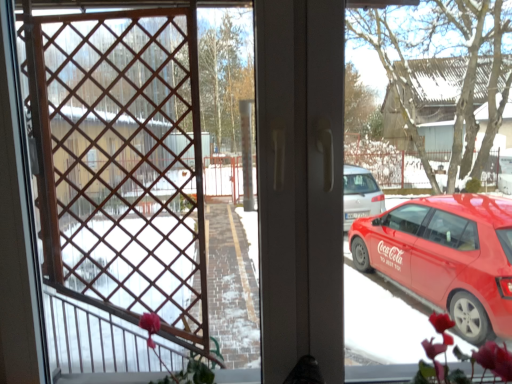
The image size is (512, 384). I want to click on matte pink roses at lower right, so click(x=460, y=358).

What is the approximate height of matte pink roses at lower right?

It is 12.79 inches.

What do you see at coordinates (460, 358) in the screenshot?
I see `matte pink roses at lower right` at bounding box center [460, 358].

Locate an element on the screen. This screenshot has width=512, height=384. matte pink roses at lower right is located at coordinates (460, 358).